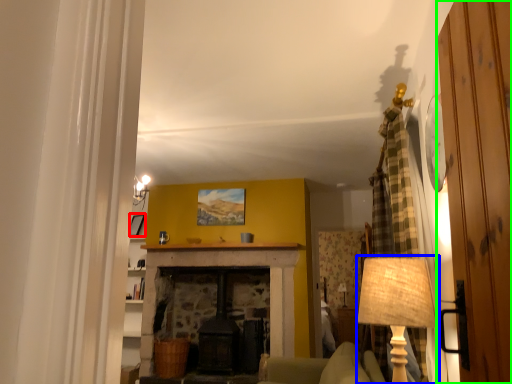
Question: Estimate the real-world distances between objects in this image. Which object is closer to picture frame (highlighted by a red box), table lamp (highlighted by a blue box) or door (highlighted by a green box)?

Choices:
 (A) table lamp
 (B) door

Answer: (A)